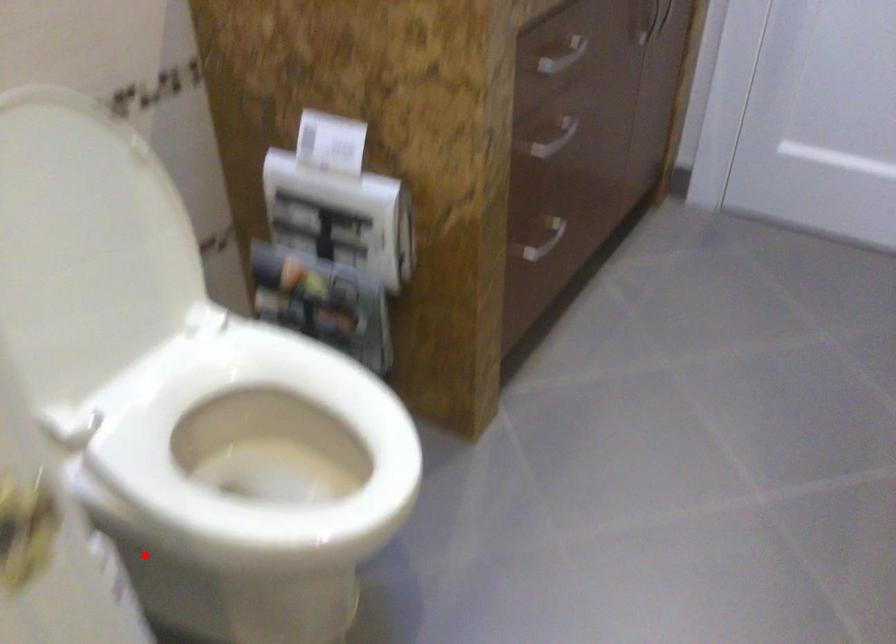
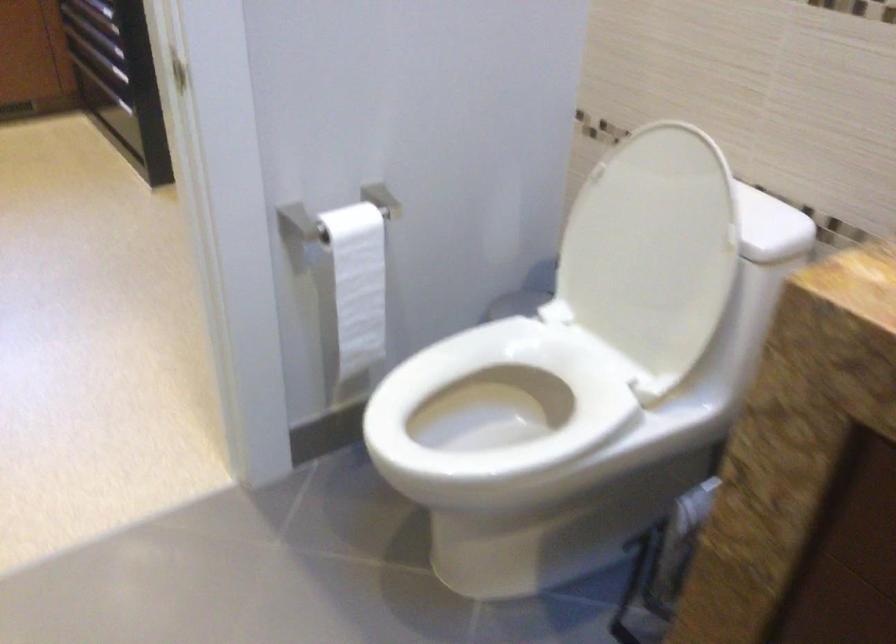
Question: A red point is marked in image1. In image2, is the corresponding 3D point closer to the camera or farther? Reply with the corresponding letter.

Choices:
 (A) The corresponding 3D point is closer.
 (B) The corresponding 3D point is farther.

Answer: (B)